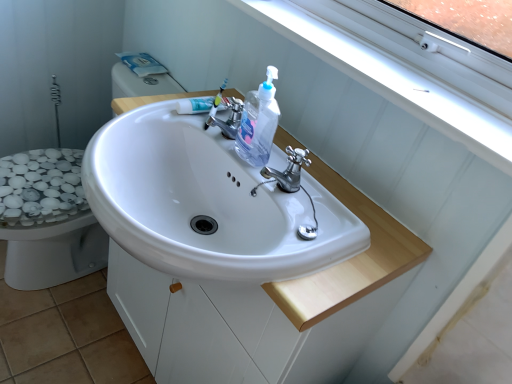
Where is `white glossy bidet at lower left`? The width and height of the screenshot is (512, 384). white glossy bidet at lower left is located at coordinates (50, 224).

This screenshot has width=512, height=384. Describe the element at coordinates (215, 105) in the screenshot. I see `white plastic toothbrush at center` at that location.

Locate an element on the screen. white plastic toothbrush at center is located at coordinates (215, 105).

This screenshot has height=384, width=512. Identify the location of clear plastic bottle at center. (258, 122).

Measure the distance between point (251, 147) and camera.

They are 35.08 inches apart.

Where is `white glossy sink at center`? This screenshot has width=512, height=384. white glossy sink at center is located at coordinates (206, 203).

The image size is (512, 384). Find the location of `polished chrome faucet at center, the second tap positioned from the back`. polished chrome faucet at center, the second tap positioned from the back is located at coordinates (287, 171).

Which object is positioned more to the left, clear plastic bottle at center or chrome metallic faucet at center, which appears as the 2th tap when viewed from the front?

chrome metallic faucet at center, which appears as the 2th tap when viewed from the front, is more to the left.

How distant is clear plastic bottle at center from chrome metallic faucet at center, which appears as the 2th tap when viewed from the front?

6.18 centimeters.

Is clear plastic bottle at center oriented away from chrome metallic faucet at center, which is counted as the second tap, starting from the right?

No, chrome metallic faucet at center, which is counted as the second tap, starting from the right, is not at the back of clear plastic bottle at center.

Considering the sizes of objects clear plastic bottle at center and chrome metallic faucet at center, marked as the first tap in a left-to-right arrangement, in the image provided, who is thinner, clear plastic bottle at center or chrome metallic faucet at center, marked as the first tap in a left-to-right arrangement,?

clear plastic bottle at center is thinner.

Is white plastic toothbrush at center to the right of white glossy bidet at lower left from the viewer's perspective?

Indeed, white plastic toothbrush at center is positioned on the right side of white glossy bidet at lower left.

Between point (216, 101) and point (80, 233), which one is positioned in front?

Positioned in front is point (216, 101).

Can you see white plastic toothbrush at center touching white glossy bidet at lower left?

white plastic toothbrush at center and white glossy bidet at lower left are not in contact.

Is white plastic window frame at upper right positioned far away from white glossy bidet at lower left?

No, white plastic window frame at upper right is in close proximity to white glossy bidet at lower left.

From the image's perspective, which is above, white plastic window frame at upper right or white glossy bidet at lower left?

white plastic window frame at upper right is shown above in the image.

Considering the relative positions of white plastic window frame at upper right and white glossy bidet at lower left in the image provided, is white plastic window frame at upper right to the left of white glossy bidet at lower left from the viewer's perspective?

Incorrect, white plastic window frame at upper right is not on the left side of white glossy bidet at lower left.

Is white glossy bidet at lower left at the back of white plastic window frame at upper right?

No, white plastic window frame at upper right is not facing the opposite direction of white glossy bidet at lower left.

Locate an element on the screen. This screenshot has width=512, height=384. toothbrush lying above the polished chrome faucet at center, the second tap positioned from the back (from the image's perspective) is located at coordinates (215, 105).

Considering the relative positions of white plastic toothbrush at center and polished chrome faucet at center, the 2th tap viewed from the top, in the image provided, is white plastic toothbrush at center to the left or to the right of polished chrome faucet at center, the 2th tap viewed from the top,?

white plastic toothbrush at center is positioned on polished chrome faucet at center, the 2th tap viewed from the top,'s left side.

Could polished chrome faucet at center, which ranks as the 1th tap in right-to-left order, be considered to be inside white plastic toothbrush at center?

No, white plastic toothbrush at center does not contain polished chrome faucet at center, which ranks as the 1th tap in right-to-left order.

How many degrees apart are the facing directions of clear plastic bottle at center and polished chrome faucet at center, the second tap positioned from the back?

The facing directions of clear plastic bottle at center and polished chrome faucet at center, the second tap positioned from the back, are 10.2 degrees apart.

Considering the relative sizes of clear plastic bottle at center and polished chrome faucet at center, which is the 2th tap in left-to-right order, in the image provided, is clear plastic bottle at center smaller than polished chrome faucet at center, which is the 2th tap in left-to-right order,?

No.

Considering the sizes of clear plastic bottle at center and polished chrome faucet at center, the second tap positioned from the back, in the image, is clear plastic bottle at center taller or shorter than polished chrome faucet at center, the second tap positioned from the back,?

Clearly, clear plastic bottle at center is taller compared to polished chrome faucet at center, the second tap positioned from the back.

Are clear plastic bottle at center and polished chrome faucet at center, the second tap positioned from the back, located far from each other?

Actually, clear plastic bottle at center and polished chrome faucet at center, the second tap positioned from the back, are a little close together.

Can you confirm if white glossy bidet at lower left is positioned to the left of chrome metallic faucet at center, which ranks as the first tap in back-to-front order?

Yes.

Is chrome metallic faucet at center, which ranks as the first tap in back-to-front order, surrounded by white glossy bidet at lower left?

No, white glossy bidet at lower left does not contain chrome metallic faucet at center, which ranks as the first tap in back-to-front order.

Is white glossy bidet at lower left turned away from chrome metallic faucet at center, which is counted as the second tap, starting from the right?

white glossy bidet at lower left does not have its back to chrome metallic faucet at center, which is counted as the second tap, starting from the right.

Is white glossy bidet at lower left thinner than chrome metallic faucet at center, which ranks as the first tap in back-to-front order?

No, white glossy bidet at lower left is not thinner than chrome metallic faucet at center, which ranks as the first tap in back-to-front order.

Is white plastic window frame at upper right spatially inside polished chrome faucet at center, the second tap positioned from the back, or outside of it?

white plastic window frame at upper right exists outside the volume of polished chrome faucet at center, the second tap positioned from the back.

Is white plastic window frame at upper right taller or shorter than polished chrome faucet at center, the 2th tap viewed from the top?

Considering their sizes, white plastic window frame at upper right has less height than polished chrome faucet at center, the 2th tap viewed from the top.

Considering the relative sizes of white plastic window frame at upper right and polished chrome faucet at center, the second tap positioned from the back, in the image provided, is white plastic window frame at upper right wider than polished chrome faucet at center, the second tap positioned from the back,?

Correct, the width of white plastic window frame at upper right exceeds that of polished chrome faucet at center, the second tap positioned from the back.

Is white plastic window frame at upper right with polished chrome faucet at center, which is the 2th tap in left-to-right order?

There is a gap between white plastic window frame at upper right and polished chrome faucet at center, which is the 2th tap in left-to-right order.

Find the location of a particular element. cleaning product above the chrome metallic faucet at center, which is counted as the second tap, starting from the right (from a real-world perspective) is located at coordinates (258, 122).

I want to click on toothbrush lying on the right of white glossy bidet at lower left, so click(x=215, y=105).

When comparing their distances from clear plastic bottle at center, does white plastic toothbrush at center or chrome metallic faucet at center, which ranks as the first tap in back-to-front order, seem closer?

chrome metallic faucet at center, which ranks as the first tap in back-to-front order, lies closer to clear plastic bottle at center than the other object.

Based on their spatial positions, is white plastic toothbrush at center or white plastic window frame at upper right further from white glossy bidet at lower left?

white plastic window frame at upper right is further to white glossy bidet at lower left.

From the image, which object appears to be nearer to white plastic toothbrush at center, clear plastic bottle at center or white glossy bidet at lower left?

clear plastic bottle at center is closer to white plastic toothbrush at center.

From the image, which object appears to be nearer to white plastic window frame at upper right, white glossy bidet at lower left or white plastic toothbrush at center?

white plastic toothbrush at center is closer to white plastic window frame at upper right.

Looking at the image, which one is located further to white glossy sink at center, polished chrome faucet at center, the second tap positioned from the back, or white plastic window frame at upper right?

white plastic window frame at upper right is positioned further to the anchor white glossy sink at center.

Looking at this image, from the image, which object appears to be farther from white plastic window frame at upper right, chrome metallic faucet at center, which is counted as the second tap, starting from the right, or polished chrome faucet at center, the 2th tap viewed from the top?

chrome metallic faucet at center, which is counted as the second tap, starting from the right, is positioned further to the anchor white plastic window frame at upper right.

When comparing their distances from clear plastic bottle at center, does polished chrome faucet at center, which ranks as the 1th tap in right-to-left order, or white plastic toothbrush at center seem closer?

polished chrome faucet at center, which ranks as the 1th tap in right-to-left order, is positioned closer to the anchor clear plastic bottle at center.

Considering their positions, is clear plastic bottle at center positioned further to white glossy sink at center than white plastic window frame at upper right?

white plastic window frame at upper right is positioned further to the anchor white glossy sink at center.

The height and width of the screenshot is (384, 512). Find the location of `cleaning product positioned between white glossy sink at center and white plastic toothbrush at center from near to far`. cleaning product positioned between white glossy sink at center and white plastic toothbrush at center from near to far is located at coordinates (258, 122).

Find the location of a particular element. cleaning product between white glossy bidet at lower left and white plastic window frame at upper right in the horizontal direction is located at coordinates (258, 122).

You are a GUI agent. You are given a task and a screenshot of the screen. Output one action in this format:
    pyautogui.click(x=<x>, y=<y>)
    Task: Click on the toothbrush situated between white glossy bidet at lower left and clear plastic bottle at center from left to right
    
    Given the screenshot: What is the action you would take?
    pyautogui.click(x=215, y=105)

Identify the location of tap between chrome metallic faucet at center, marked as the first tap in a left-to-right arrangement, and white plastic window frame at upper right, in the horizontal direction. (287, 171).